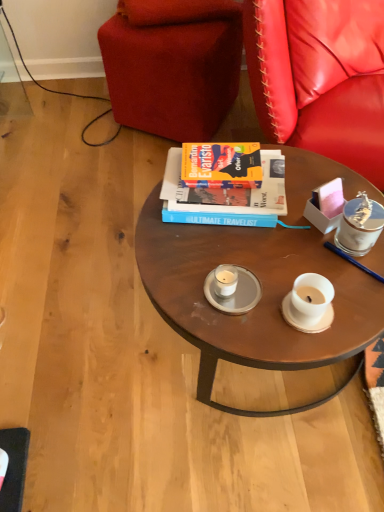
What are the coordinates of `vacant space situated above hardcover book at center (from a real-world perspective)` in the screenshot? It's located at (220, 159).